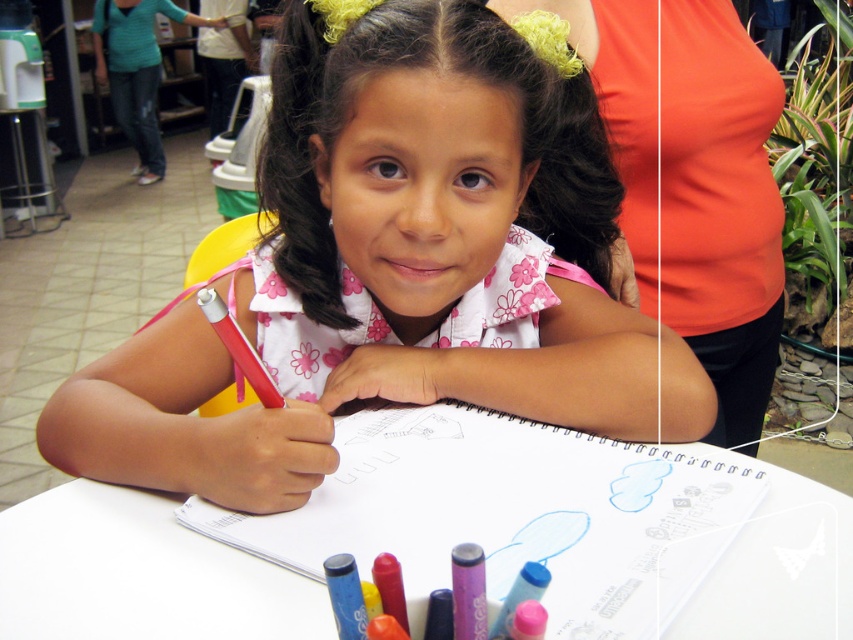
Question: Is pink floral blouse at center to the left of matte red pencil at center from the viewer's perspective?

Choices:
 (A) yes
 (B) no

Answer: (B)

Question: Does pink floral blouse at center appear on the left side of white paper at center?

Choices:
 (A) yes
 (B) no

Answer: (A)

Question: Which of these objects is positioned closest to the matte red pencil at center?

Choices:
 (A) white paper at center
 (B) matte pink crayon at center

Answer: (A)

Question: Which of the following is the farthest from the observer?

Choices:
 (A) (71, 557)
 (B) (213, 292)

Answer: (A)

Question: Which point is closer to the camera taking this photo?

Choices:
 (A) (386, 499)
 (B) (200, 292)
 (C) (402, 604)

Answer: (C)

Question: From the image, what is the correct spatial relationship of pink floral blouse at center in relation to white paper at center?

Choices:
 (A) below
 (B) above

Answer: (B)